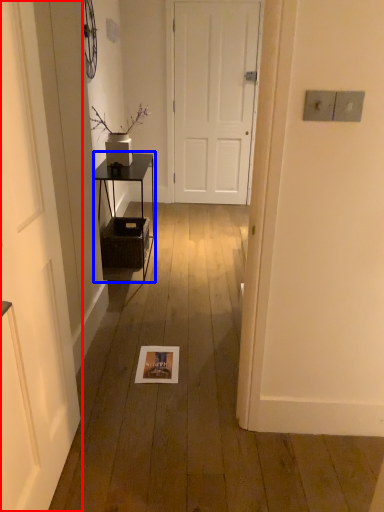
Question: Among these objects, which one is farthest to the camera, door (highlighted by a red box) or table (highlighted by a blue box)?

Choices:
 (A) door
 (B) table

Answer: (B)